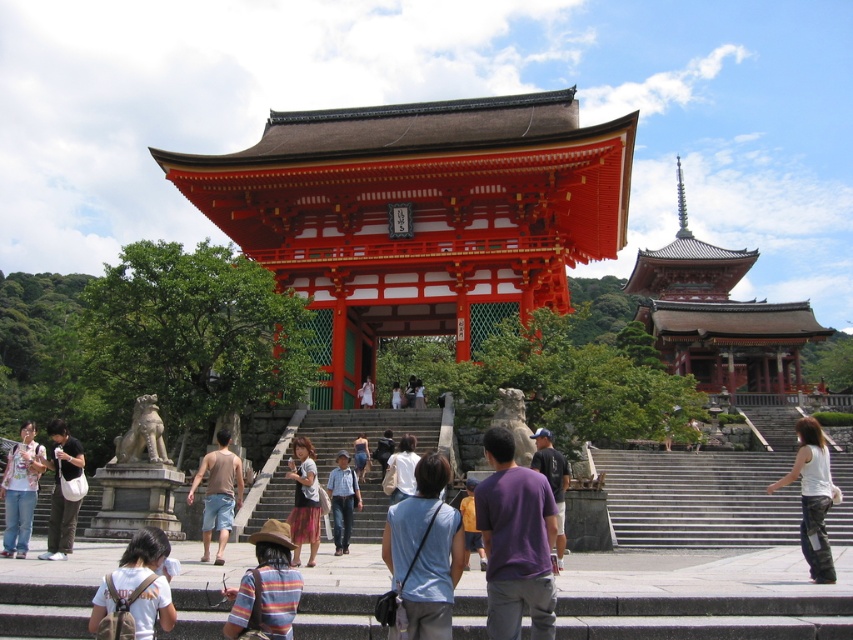
Is purple cotton shirt at center positioned in front of matte white bag at lower left?

Yes, it is.

Is purple cotton shirt at center smaller than matte white bag at lower left?

Yes.

Is point (511, 628) closer to camera compared to point (70, 522)?

Yes, it is in front of point (70, 522).

Where is `purple cotton shirt at center`? Image resolution: width=853 pixels, height=640 pixels. purple cotton shirt at center is located at coordinates (515, 541).

Who is positioned more to the left, white marble stairs at center or white cotton backpack at lower left?

Positioned to the left is white cotton backpack at lower left.

Is point (709, 467) positioned after point (161, 625)?

That is True.

Is point (613, 502) closer to camera compared to point (138, 604)?

No, it is not.

Where is `white marble stairs at center`? The image size is (853, 640). white marble stairs at center is located at coordinates (698, 499).

Looking at this image, is smooth stone stairs at center positioned behind denim shorts at center?

No, smooth stone stairs at center is in front of denim shorts at center.

Is smooth stone stairs at center above denim shorts at center?

Actually, smooth stone stairs at center is below denim shorts at center.

Does point (358, 413) come behind point (363, 456)?

That is True.

In order to click on smooth stone stairs at center in this screenshot , I will do `click(335, 451)`.